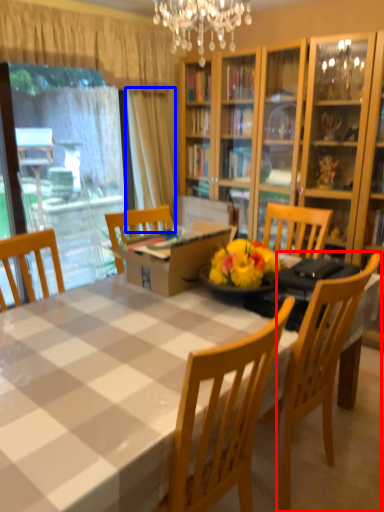
Question: Which point is closer to the camera, chair (highlighted by a red box) or curtain (highlighted by a blue box)?

Choices:
 (A) chair
 (B) curtain

Answer: (A)